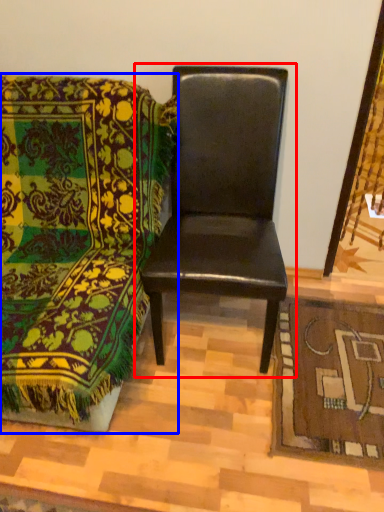
Question: Which object is closer to the camera taking this photo, chair (highlighted by a red box) or chair (highlighted by a blue box)?

Choices:
 (A) chair
 (B) chair

Answer: (B)